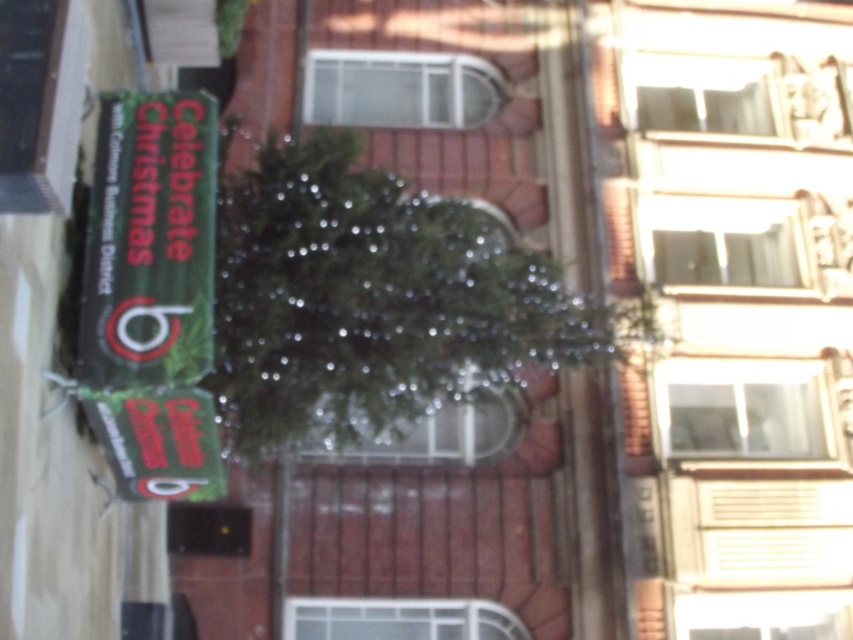
Is point (415, 282) closer to camera compared to point (134, 371)?

No.

What are the coordinates of `green shiny tree at center` in the screenshot? It's located at (375, 298).